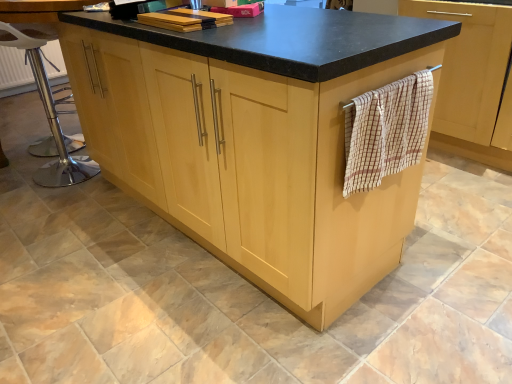
Question: Based on their sizes in the image, would you say polished chrome bar stool at left is bigger or smaller than beige checkered towel at right?

Choices:
 (A) big
 (B) small

Answer: (A)

Question: Considering the positions of polished chrome bar stool at left and beige checkered towel at right in the image, is polished chrome bar stool at left wider or thinner than beige checkered towel at right?

Choices:
 (A) thin
 (B) wide

Answer: (A)

Question: Which is farther from the wooden cutting board at upper center?

Choices:
 (A) light wood cupboard at center
 (B) wooden towel rack at right
 (C) polished chrome bar stool at left
 (D) beige checkered towel at right

Answer: (B)

Question: Which of these objects is positioned farthest from the beige checkered towel at right?

Choices:
 (A) polished chrome bar stool at left
 (B) light wood cupboard at center
 (C) wooden cutting board at upper center
 (D) wooden towel rack at right

Answer: (A)